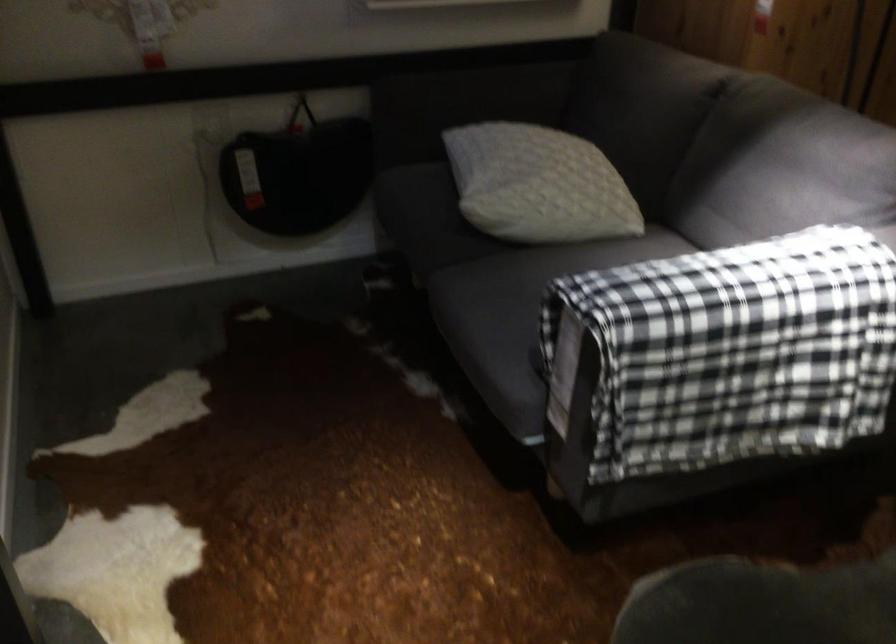
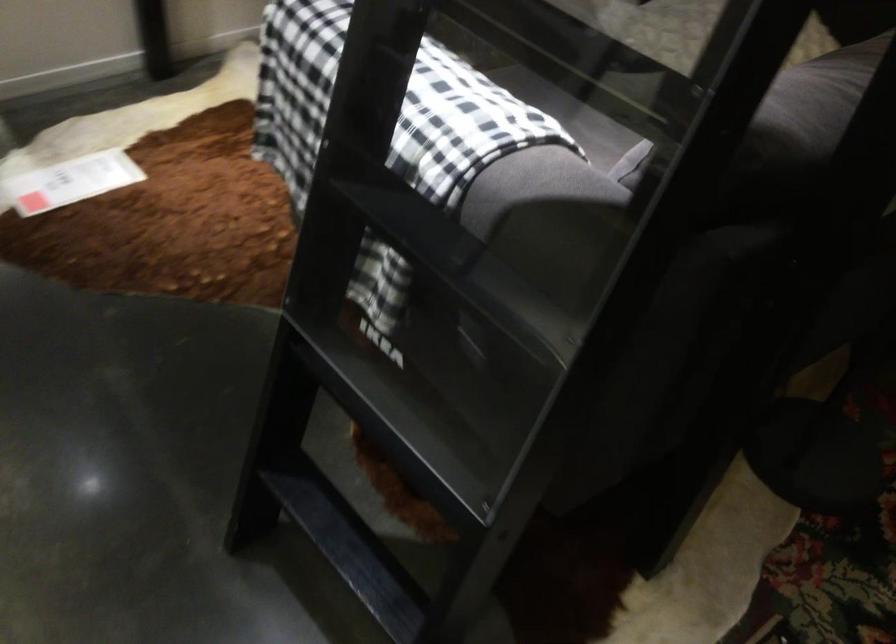
Question: I am providing you with two images of the same scene from different viewpoints. Please identify which objects are invisible in image2.

Choices:
 (A) black laptop computer
 (B) plaid throw blanket
 (C) sofa sitting surface
 (D) black ladder rung

Answer: (B)